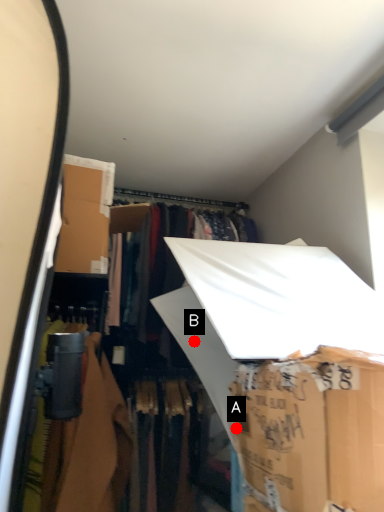
Question: Two points are circled on the image, labeled by A and B beside each circle. Which point is closer to the camera?

Choices:
 (A) A is closer
 (B) B is closer

Answer: (A)